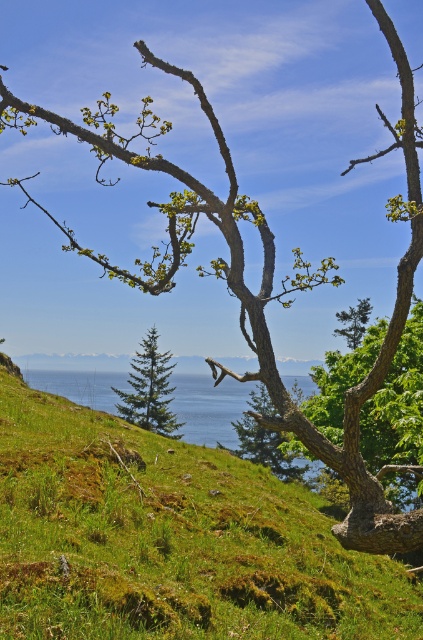
Question: Does blue water at center appear under green matte tree at center?

Choices:
 (A) yes
 (B) no

Answer: (A)

Question: Does green mossy hillside at center have a lesser width compared to green leafy tree at center?

Choices:
 (A) yes
 (B) no

Answer: (B)

Question: Based on their relative distances, which object is nearer to the green matte tree at center?

Choices:
 (A) green leafy tree at center
 (B) green matte evergreen tree at center

Answer: (A)

Question: Among these points, which one is farthest from the camera?

Choices:
 (A) (360, 317)
 (B) (66, 390)

Answer: (B)

Question: Which object is positioned farthest from the green matte tree at center?

Choices:
 (A) green mossy hillside at center
 (B) green leafy tree at center
 (C) blue water at center

Answer: (A)

Question: Does blue water at center have a greater width compared to green matte evergreen tree at center?

Choices:
 (A) no
 (B) yes

Answer: (B)